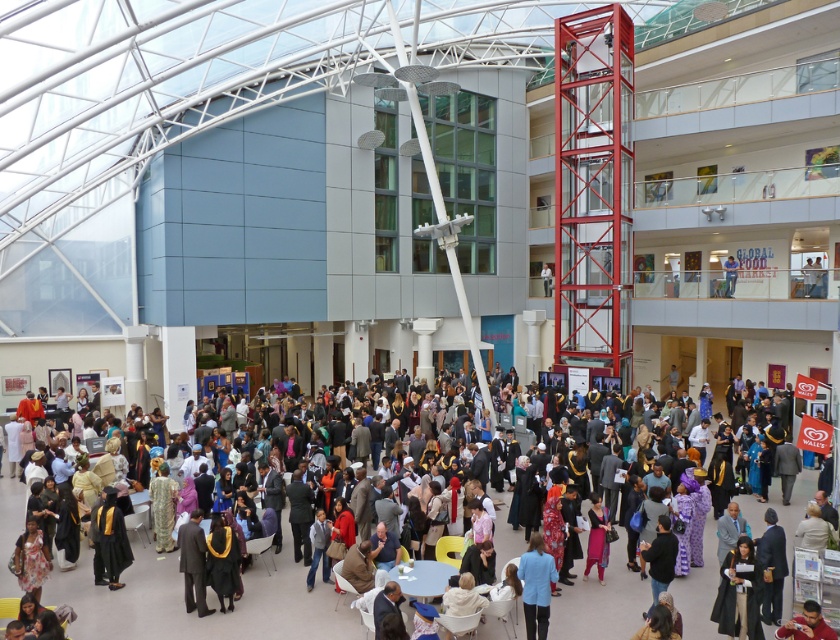
You are standing in the atrium and want to take a photo of the matte black graduation gown at center from a distance that ensures it appears clearly in the frame. Considering the typical focal range of a smartphone camera, which is about 1 meter to infinity, can you capture the gown clearly from your current position?

Yes, the matte black graduation gown at center is 10.60 meters away from the viewer, which is within the focal range of a smartphone camera. Therefore, you can capture the gown clearly from your current position.

You are organizing a photo shoot in the atrium and need to position two props. The matte black graduation gown at center and the blue fabric jacket at lower center must be placed on a table. Considering their sizes, which prop requires a larger space on the table?

The matte black graduation gown at center requires a larger space on the table because its width surpasses that of the blue fabric jacket at lower center.

You are at the event and want to locate the blue fabric jacket at lower center and the matte black suit at center. Which one is positioned to the left of the other?

The blue fabric jacket at lower center is to the left of the matte black suit at center.